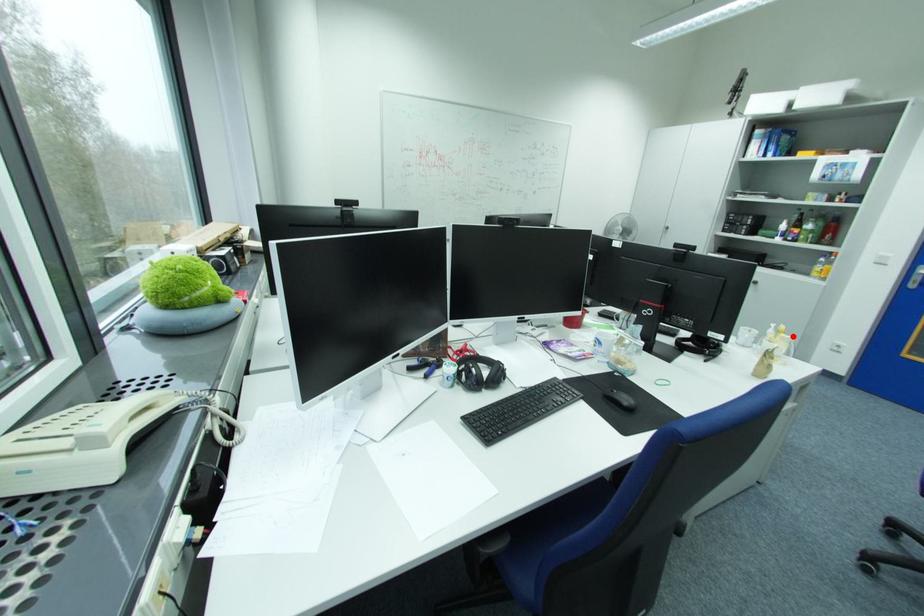
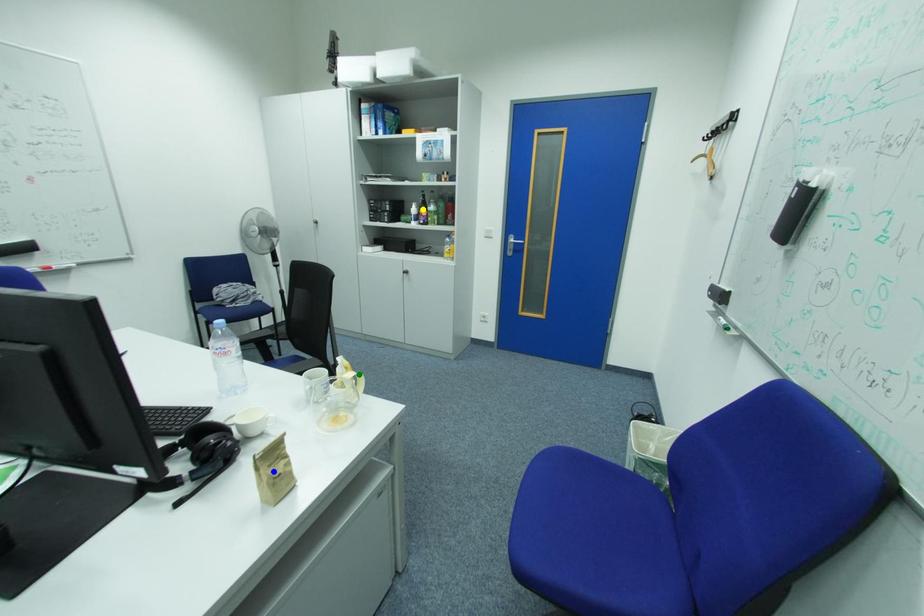
Question: I am providing you with two images of the same scene from different viewpoints. A red point is marked on the first image. You are given multiple points on the second image. Can you choose the point in image 2 that corresponds to the point in image 1?

Choices:
 (A) blue point
 (B) green point
 (C) yellow point

Answer: (B)